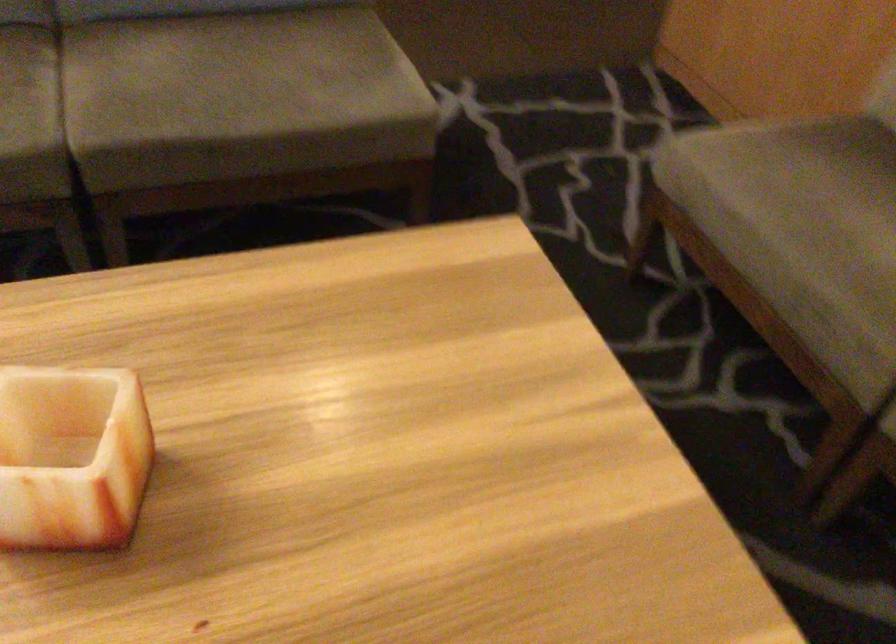
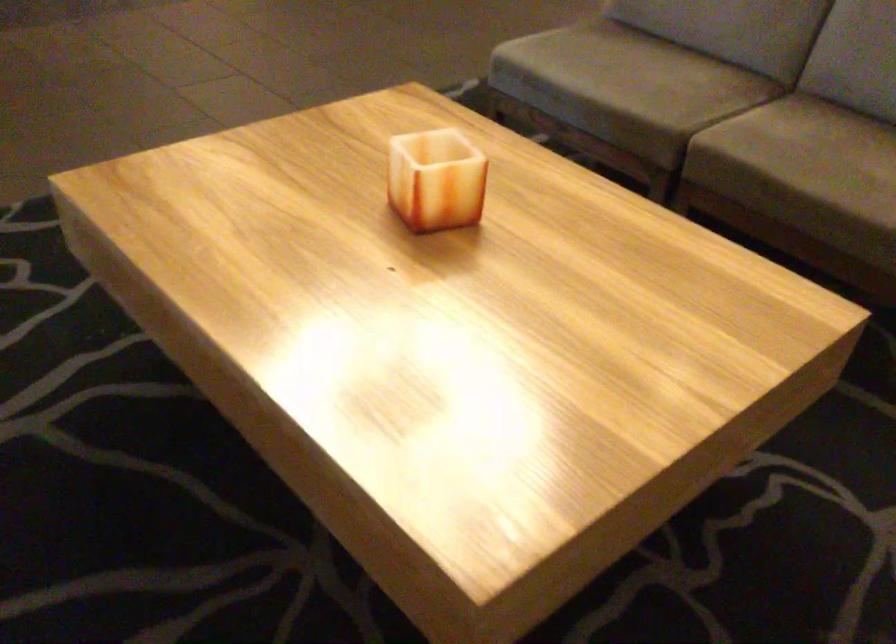
Locate, in the second image, the point that corresponds to pixel 225 104 in the first image.

(800, 161)